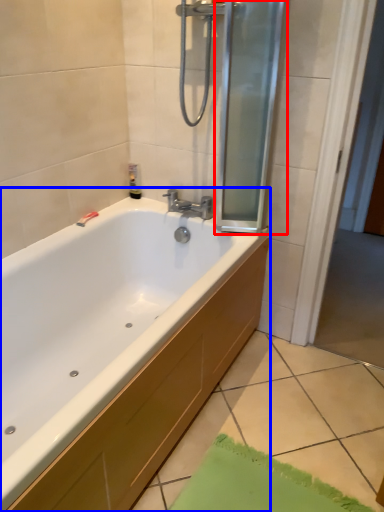
Question: Which point is closer to the camera, screen door (highlighted by a red box) or bathtub (highlighted by a blue box)?

Choices:
 (A) screen door
 (B) bathtub

Answer: (B)